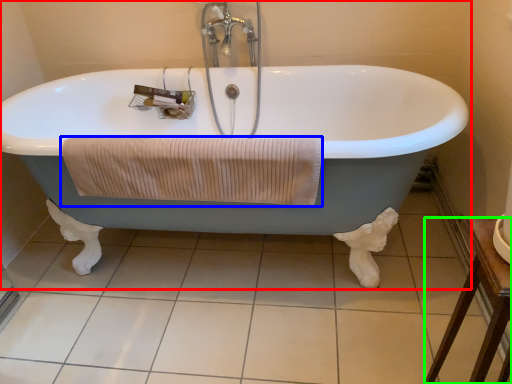
Question: Which object is the farthest from bathtub (highlighted by a red box)? Choose among these: bath towel (highlighted by a blue box) or furniture (highlighted by a green box).

Choices:
 (A) bath towel
 (B) furniture

Answer: (B)